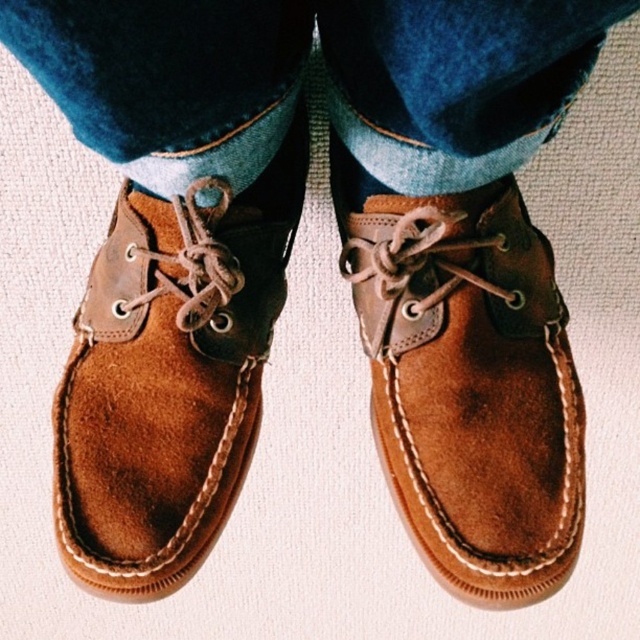
You are a fashion designer observing the image. You need to determine the layering order of the denim at center and the suede brown shoe at center. Which one is covering the other?

The denim at center is in front of the suede brown shoe at center, so it is covering the shoe.

You are a photographer trying to capture a detailed shot of the person in the scene. The camera is positioned at a certain distance. Given that the point at coordinates point (192, 54) is 31.32 inches away from the camera, can you determine if this point is within the camera frame?

The point at coordinates point (192, 54) is 31.32 inches away from the camera, so it is within the camera frame.